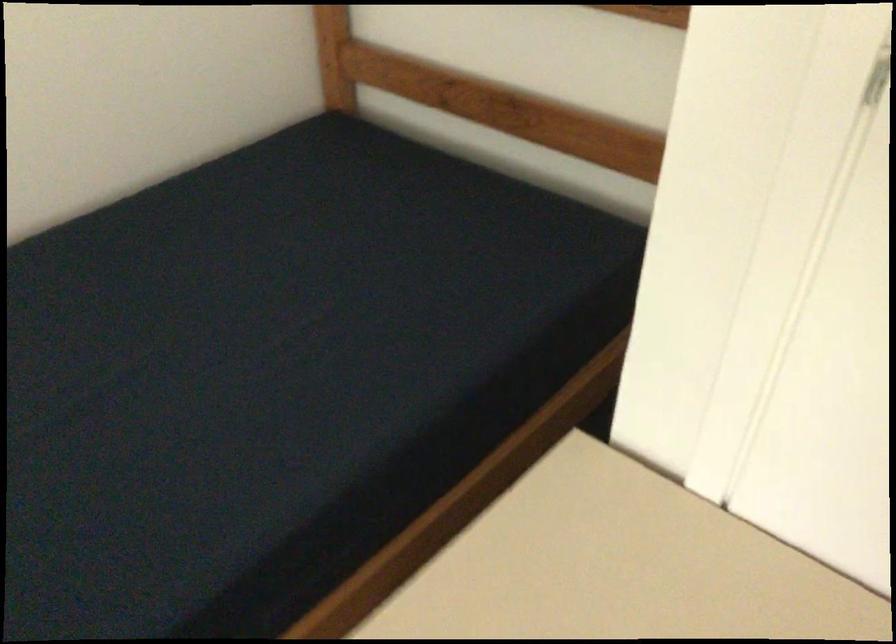
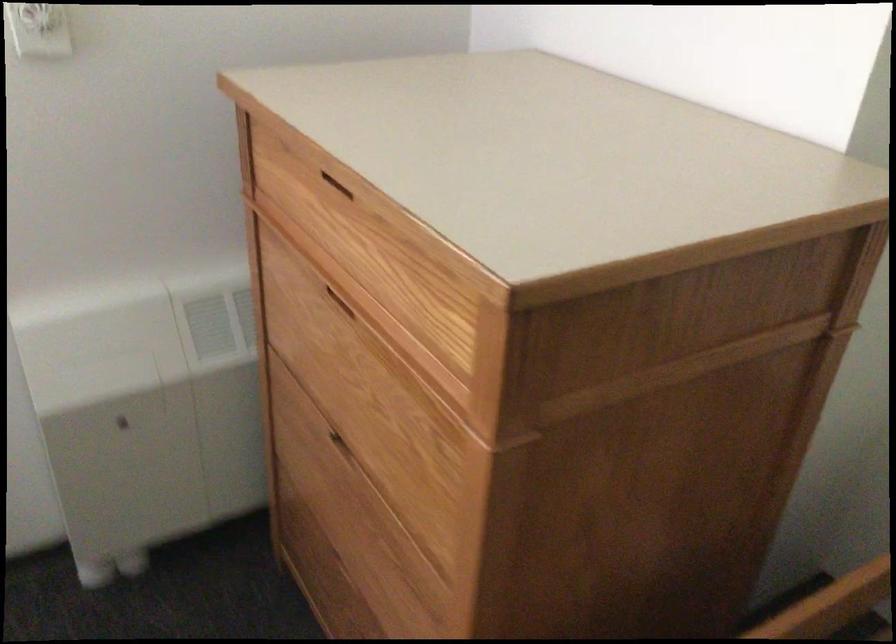
From the picture: The images are taken continuously from a first-person perspective. In which direction is your viewpoint rotating?

The camera rotated toward left-down.